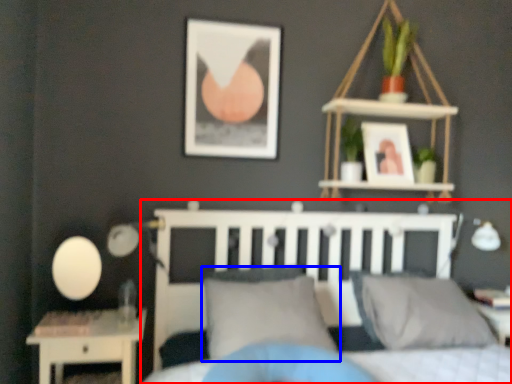
Question: Which point is further to the camera, bed (highlighted by a red box) or pillow (highlighted by a blue box)?

Choices:
 (A) bed
 (B) pillow

Answer: (B)